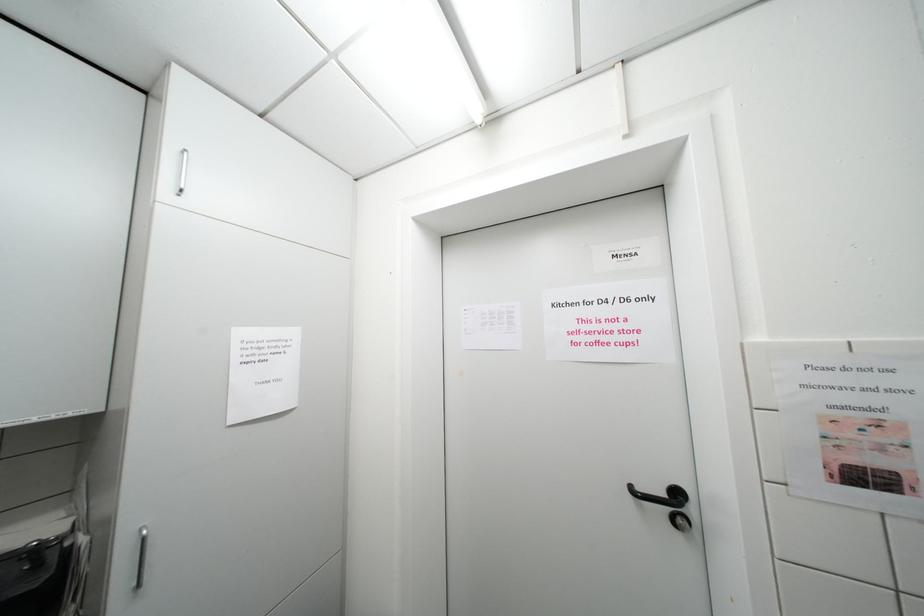
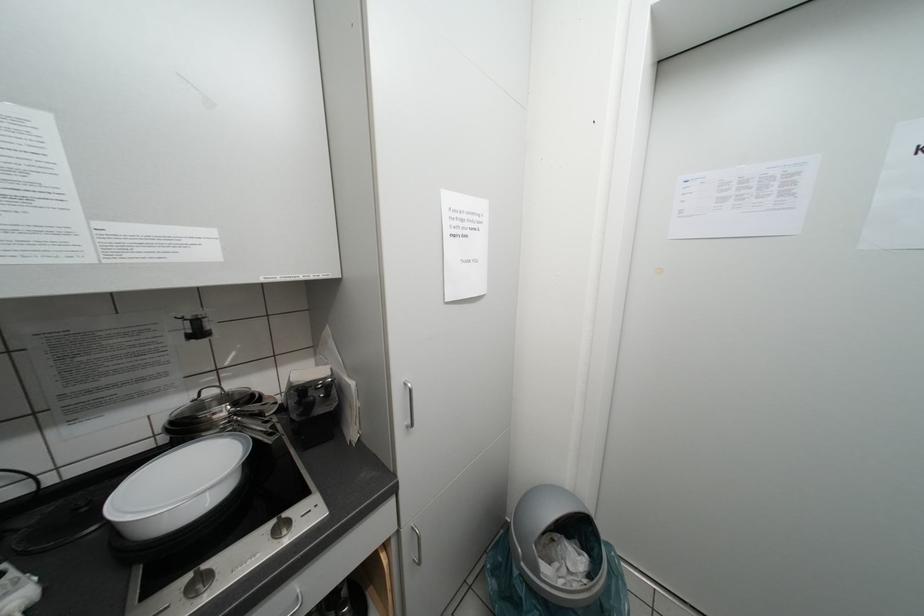
Question: What movement of the cameraman would produce the second image?

Choices:
 (A) Left
 (B) Right
 (C) Forward
 (D) Backward

Answer: (A)